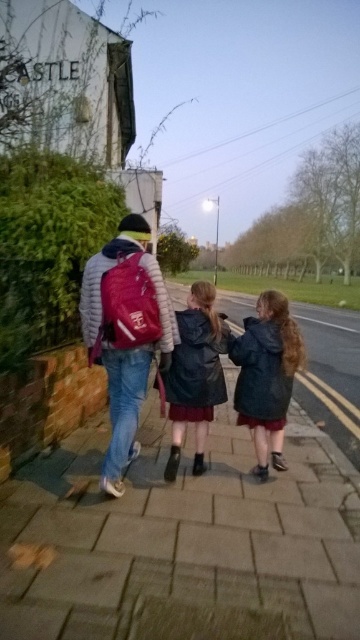
Is point (113, 252) farther from camera compared to point (240, 362)?

No, (113, 252) is closer to viewer.

Is matte pink backpack at left positioned behind dark blue jacket at center?

No, it is in front of dark blue jacket at center.

Between point (123, 260) and point (276, 445), which one is positioned in front?

Point (123, 260)

Identify the location of matte pink backpack at left. (125, 333).

Which is in front, point (320, 608) or point (223, 388)?

Point (320, 608) is more forward.

Who is shorter, paved stone sidewalk at center or leather jacket at center?

paved stone sidewalk at center is shorter.

The height and width of the screenshot is (640, 360). Find the location of `paved stone sidewalk at center`. paved stone sidewalk at center is located at coordinates (182, 540).

Locate an element on the screen. paved stone sidewalk at center is located at coordinates (182, 540).

From the picture: Does paved stone sidewalk at center have a lesser width compared to dark blue jacket at center?

No.

Does paved stone sidewalk at center appear under dark blue jacket at center?

Indeed, paved stone sidewalk at center is positioned under dark blue jacket at center.

Is point (195, 596) positioned before point (244, 412)?

Yes.

In order to click on paved stone sidewalk at center in this screenshot , I will do `click(182, 540)`.